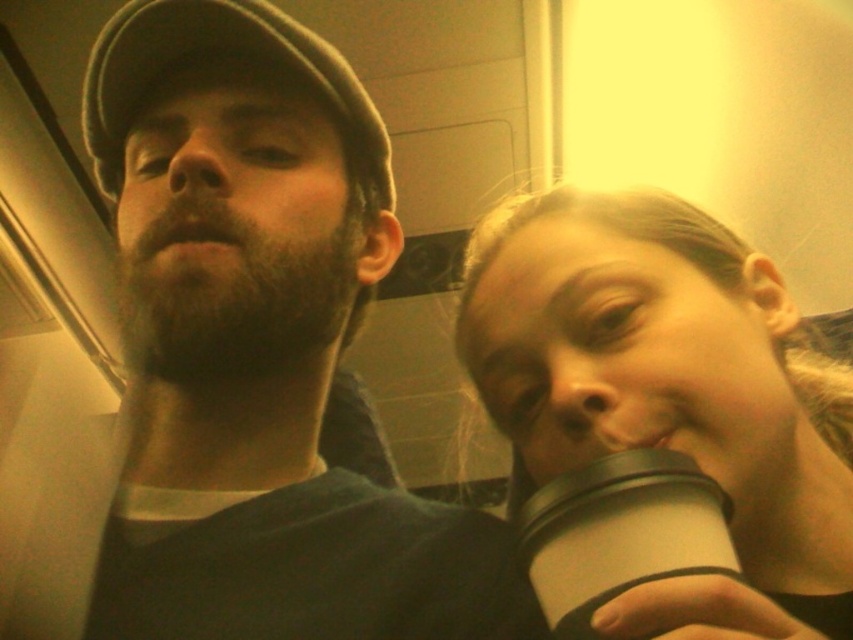
Question: Which object is closer to the camera taking this photo?

Choices:
 (A) white matte cup at lower right
 (B) matte black cap at upper left
 (C) white matte cup at right

Answer: (C)

Question: Estimate the real-world distances between objects in this image. Which object is closer to the white matte cup at right?

Choices:
 (A) white matte cup at lower right
 (B) matte black cap at upper left

Answer: (B)

Question: Is matte black cap at upper left smaller than white matte cup at right?

Choices:
 (A) yes
 (B) no

Answer: (A)

Question: Estimate the real-world distances between objects in this image. Which object is closer to the matte black cap at upper left?

Choices:
 (A) white matte cup at lower right
 (B) white matte cup at right

Answer: (B)

Question: Does matte black cap at upper left appear under white matte cup at right?

Choices:
 (A) yes
 (B) no

Answer: (B)

Question: Can you confirm if white matte cup at right is positioned below white matte cup at lower right?

Choices:
 (A) no
 (B) yes

Answer: (A)